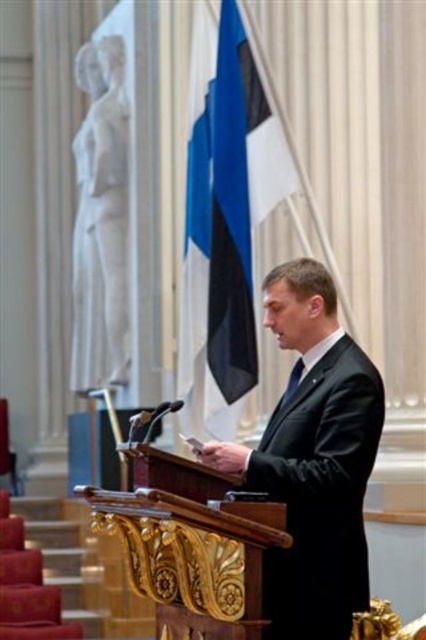
You are an event organizer who needs to ensure the speaker is properly dressed for the ceremony. Based on the image, is the black glossy suit at center correctly placed relative to the black satin tie at center?

The black glossy suit at center is positioned under the black satin tie at center, which is the correct placement since a suit should be worn below a tie.

Looking at this image, you are an event planner setting up a stage for a formal speech. The stage has a podium with two microphones and a man in a dark suit standing there. You need to place a blue fabric flag at center. Where exactly should you position it based on the coordinates provided?

The blue fabric flag at center should be positioned at the coordinates point (230, 241) as specified.

Looking at this image, you are an event organizer who needs to adjust the stage setup. The blue fabric flag at center and the black satin tie at center are both visible from the audience. Which object is positioned to the left when viewed from the audience perspective?

The blue fabric flag at center is to the left of the black satin tie at center from the audience perspective.